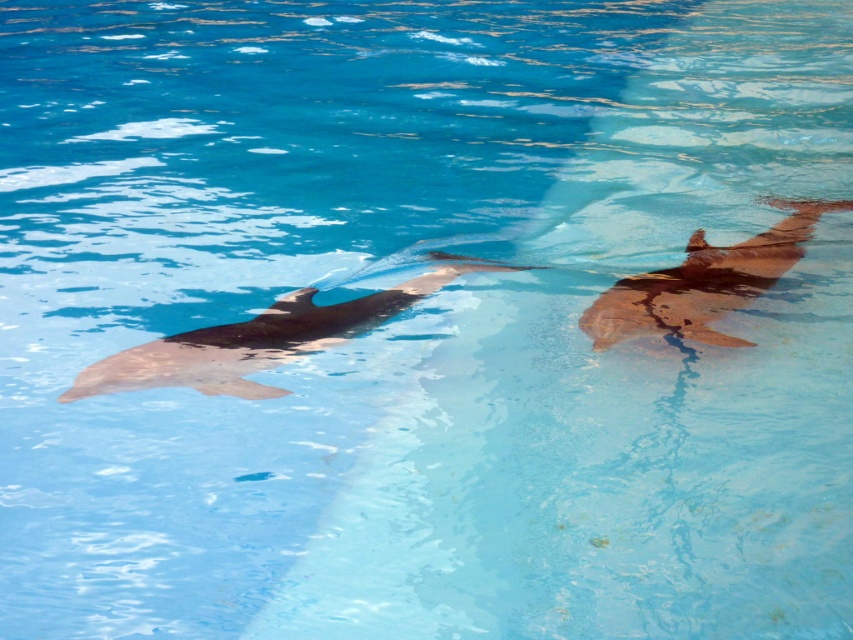
You are standing at the edge of the dolphin pool and want to know how far the point at coordinates point (213, 353) is from you. Can you determine the distance?

The point (213, 353) is 15.78 feet away from the viewer.

Consider the image. You are a marine biologist observing two dolphins in a pool. You need to determine which dolphin is wider. The dolphins are the smooth gray dolphin at center and the smooth brown dolphin at right. Which one is wider?

The smooth gray dolphin at center is wider than the smooth brown dolphin at right.

You are observing two dolphins in a pool. The smooth gray dolphin at center and the smooth brown dolphin at right are swimming. Which dolphin is shorter in height?

A: The smooth gray dolphin at center has a lesser height compared to the smooth brown dolphin at right, so the smooth gray dolphin at center is shorter in height.